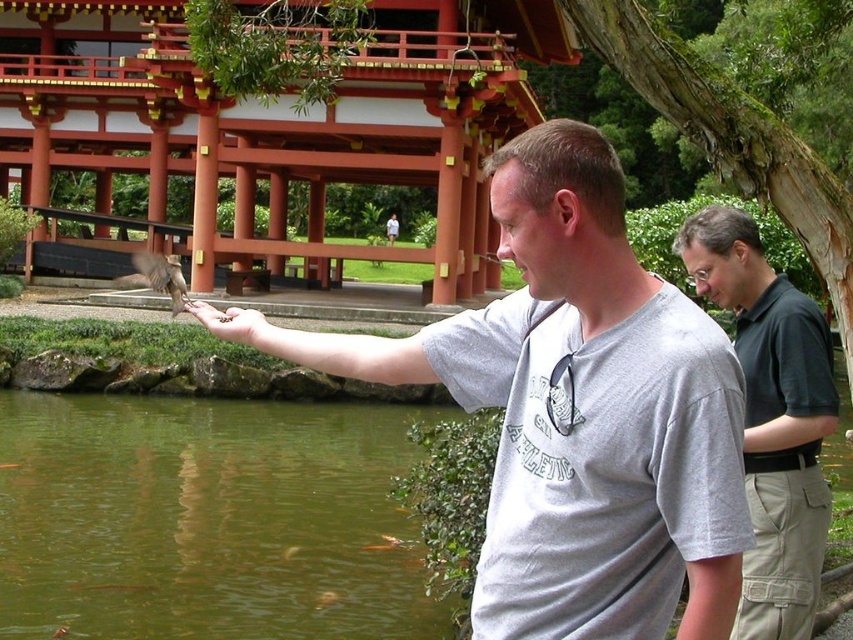
Question: Which of the following is the farthest from the observer?

Choices:
 (A) (619, 460)
 (B) (38, 600)

Answer: (B)

Question: Is gray matte shirt at center bigger than dark green polo shirt at right?

Choices:
 (A) yes
 (B) no

Answer: (B)

Question: Which point appears closest to the camera in this image?

Choices:
 (A) (685, 241)
 (B) (218, 456)
 (C) (589, 634)

Answer: (C)

Question: Can you confirm if green liquid water at lower left is positioned below dark green polo shirt at right?

Choices:
 (A) no
 (B) yes

Answer: (B)

Question: Which object is the farthest from the dark green polo shirt at right?

Choices:
 (A) green liquid water at lower left
 (B) gray matte shirt at center

Answer: (A)

Question: Can you confirm if green liquid water at lower left is positioned to the right of dark green polo shirt at right?

Choices:
 (A) yes
 (B) no

Answer: (B)